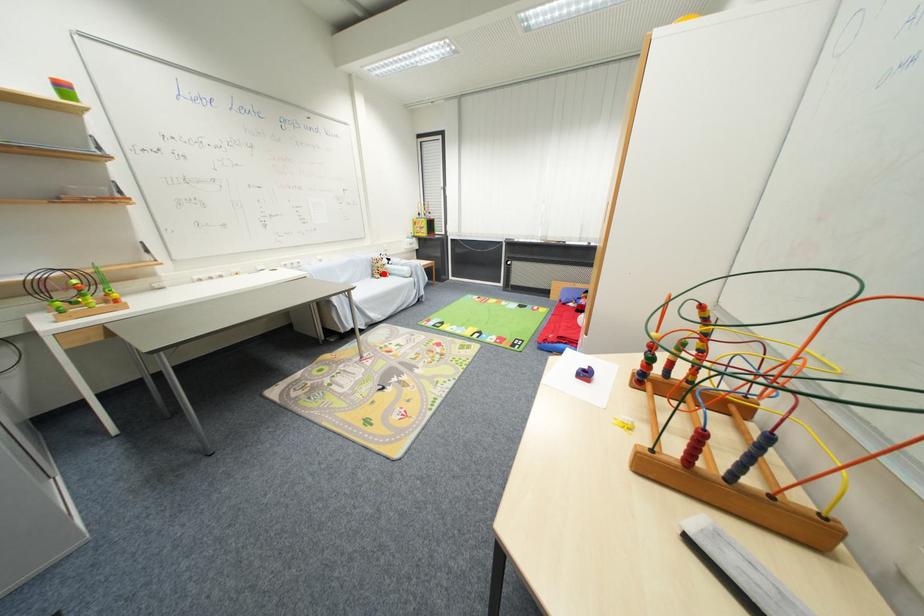
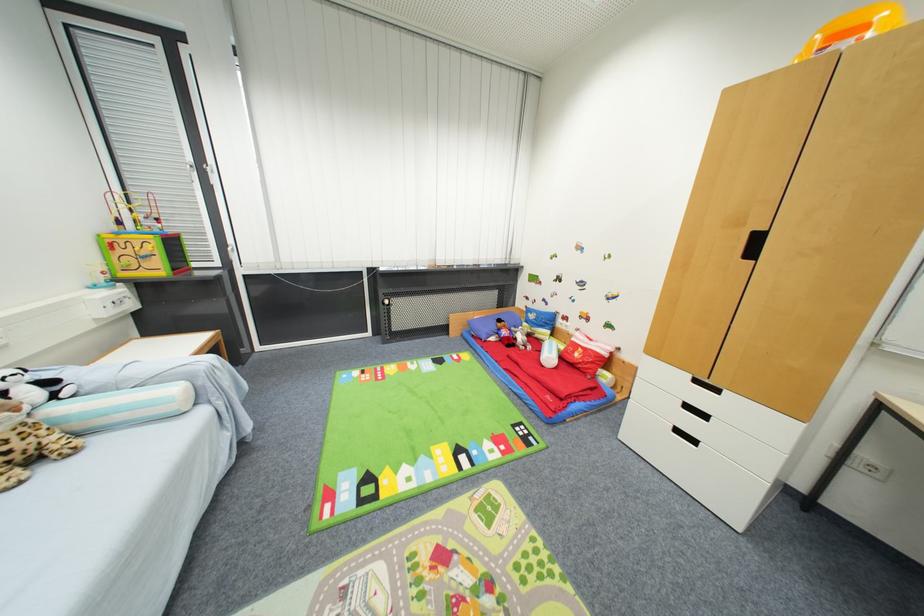
Question: I am providing you with two images of the same scene from different viewpoints. A red point is shown in image1. For the corresponding object point in image2, is it positioned nearer or farther from the camera?

Choices:
 (A) Nearer
 (B) Farther

Answer: (B)